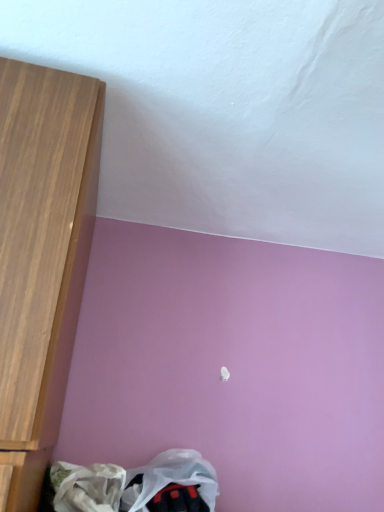
In order to face black fabric laundry at lower center, should I rotate leftwards or rightwards?

It's best to rotate left around 2.824 degrees.

The image size is (384, 512). What do you see at coordinates (136, 484) in the screenshot?
I see `black fabric laundry at lower center` at bounding box center [136, 484].

At what (x,y) coordinates should I click in order to perform the action: click on black fabric laundry at lower center. Please return your answer as a coordinate pair (x, y). The image size is (384, 512). Looking at the image, I should click on (136, 484).

I want to click on black fabric laundry at lower center, so click(136, 484).